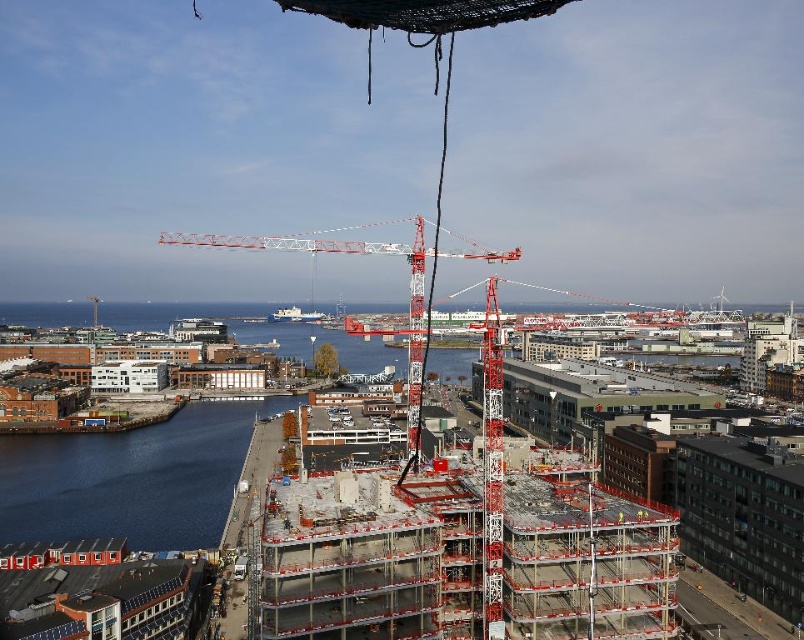
You are a construction worker standing at the edge of the construction site. You need to move a heavy beam from the red metal crane at center to the concrete building at center. Which direction should you move the beam to ensure it reaches the correct location?

You should move the beam to the right because the concrete building at center is located to the right of the red metal crane at center.

You are an architect visiting the construction site. You notice the concrete building at center and the red metal crane at center. Which one has a larger physical size?

The concrete building at center is bigger than the red metal crane at center.